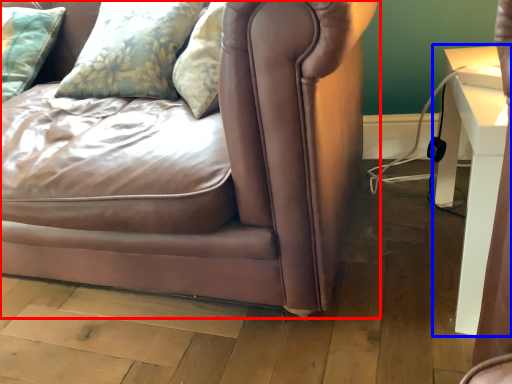
Question: Among these objects, which one is nearest to the camera, studio couch (highlighted by a red box) or table (highlighted by a blue box)?

Choices:
 (A) studio couch
 (B) table

Answer: (A)